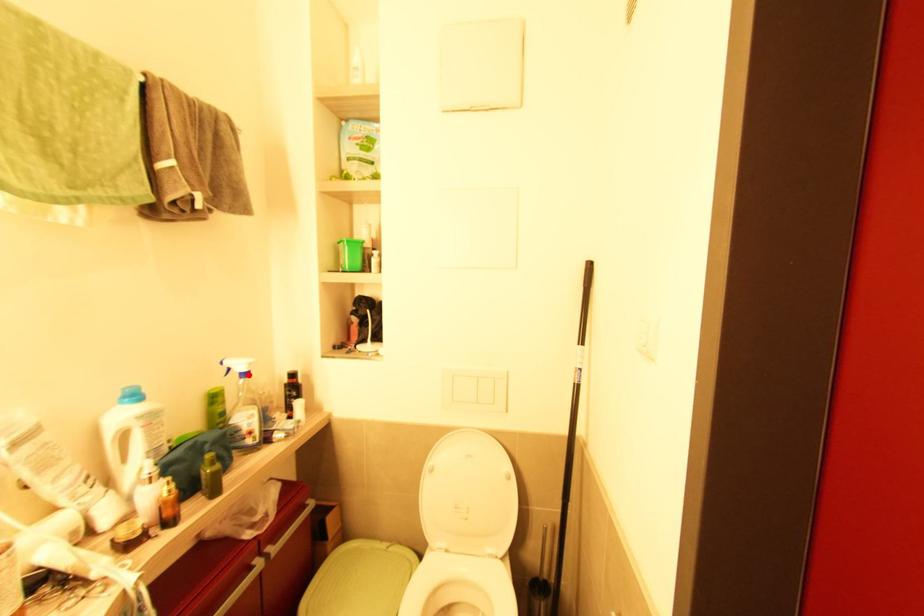
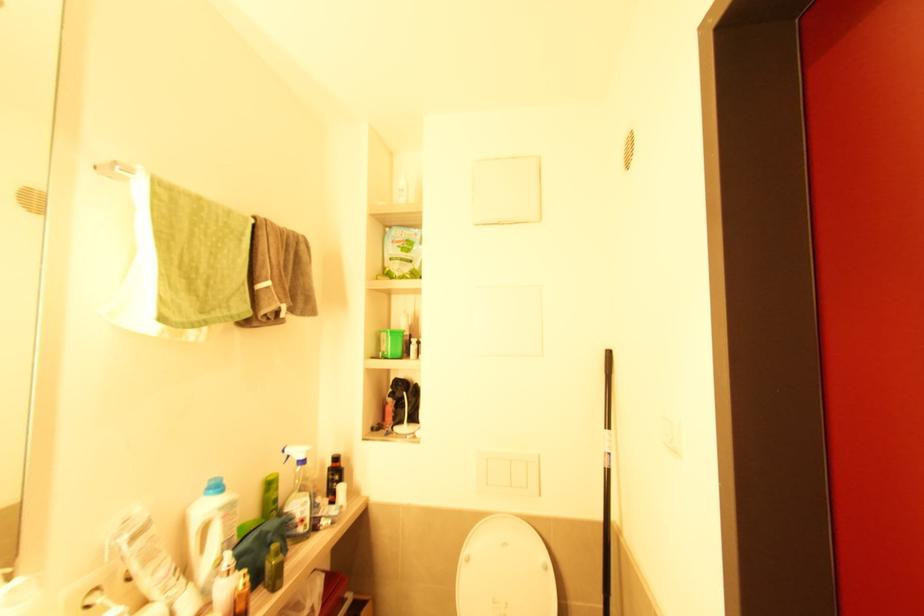
Locate, in the second image, the point that corresponds to the highlighted location in the first image.

(305, 462)